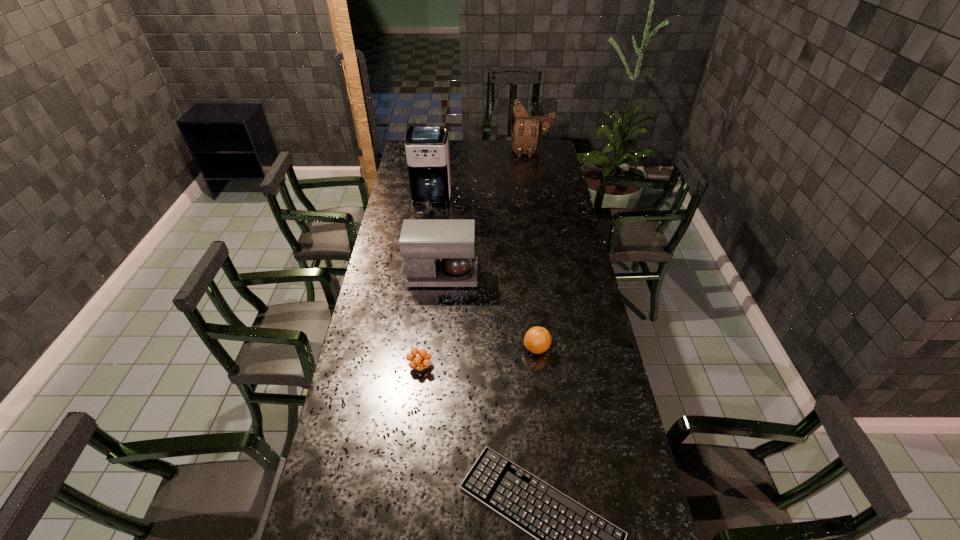
Locate an element on the screen. the tallest object is located at coordinates (427, 147).

In order to click on the farther coffee maker in this screenshot , I will do `click(427, 147)`.

This screenshot has width=960, height=540. In order to click on the farthest object in this screenshot , I will do `click(527, 130)`.

Locate an element on the screen. shoulder bag is located at coordinates (527, 130).

Identify the location of the shorter coffee maker. Image resolution: width=960 pixels, height=540 pixels. (x=437, y=252).

At what (x,y) coordinates should I click in order to perform the action: click on the nearer coffee maker. Please return your answer as a coordinate pair (x, y). The width and height of the screenshot is (960, 540). Looking at the image, I should click on (437, 252).

Where is `the taller orange fruit`? the taller orange fruit is located at coordinates (537, 340).

Identify the location of the third shortest object. (537, 340).

At what (x,y) coordinates should I click in order to perform the action: click on the shorter orange fruit. Please return your answer as a coordinate pair (x, y). Image resolution: width=960 pixels, height=540 pixels. Looking at the image, I should click on (420, 362).

The width and height of the screenshot is (960, 540). In order to click on the left orange fruit in this screenshot , I will do `click(420, 362)`.